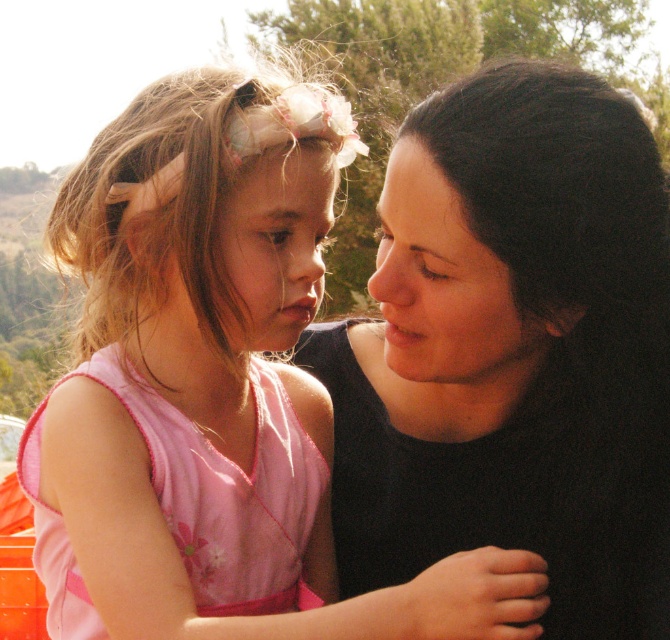
Does pink satin dress at center have a greater width compared to black matte hair at upper right?

Yes.

Which is in front, point (405, 609) or point (373, 420)?

Point (405, 609) is in front.

Find the location of a particular element. pink satin dress at center is located at coordinates (214, 390).